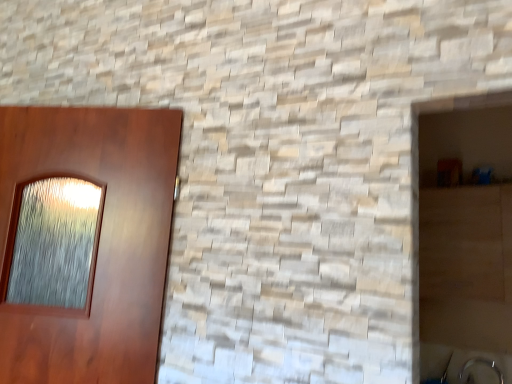
Identify the location of satin nickel faucet at lower right. The height and width of the screenshot is (384, 512). (483, 363).

Image resolution: width=512 pixels, height=384 pixels. Describe the element at coordinates (483, 363) in the screenshot. I see `satin nickel faucet at lower right` at that location.

Image resolution: width=512 pixels, height=384 pixels. Find the location of `satin nickel faucet at lower right`. satin nickel faucet at lower right is located at coordinates coord(483,363).